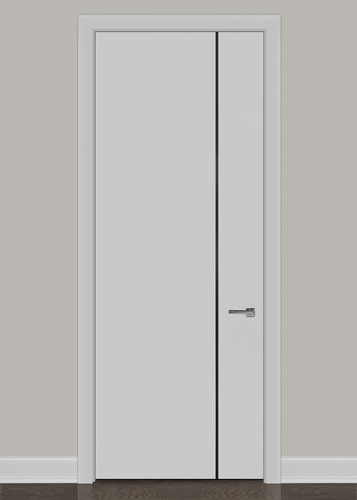
You are a GUI agent. You are given a task and a screenshot of the screen. Output one action in this format:
    pyautogui.click(x=<x>, y=<y>)
    Task: Click on the left trim
    
    Given the screenshot: What is the action you would take?
    pyautogui.click(x=42, y=472)